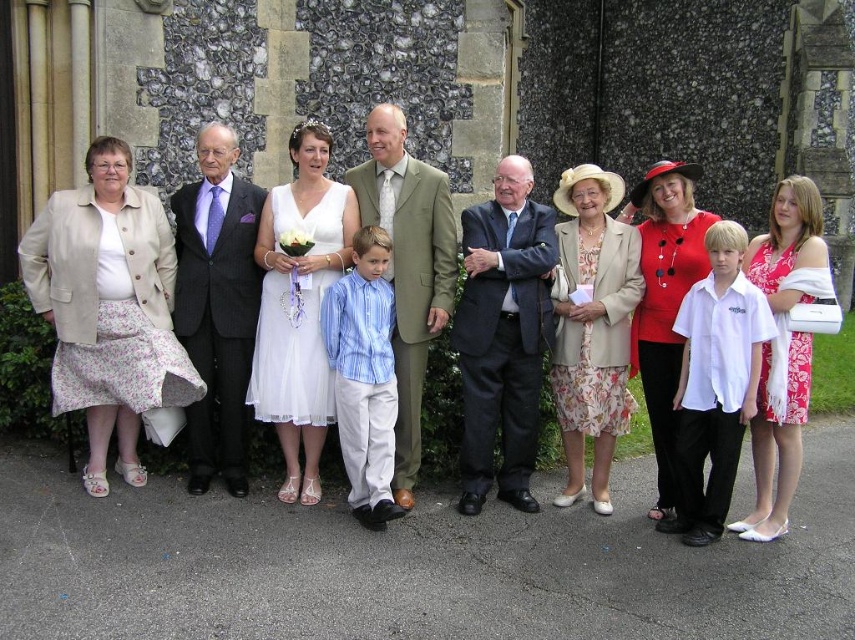
You are a photographer adjusting your camera settings to focus on the floral cotton skirt at left and the white floral dress at center. Which one should you focus on first if you want to capture both in sharp focus?

You should focus on the floral cotton skirt at left first because it is closer to you than the white floral dress at center, ensuring both will be in focus when using depth of field properly.

You are a photographer standing at the edge of a garden, 20 meters away from the stone building where the group is posing. You notice the white floral dress at center in the scene. Can you clearly see the details of the dress from your current position?

The white floral dress at center is 19.87 meters away from the viewer. Since you are standing 20 meters away, you are just slightly farther than the distance to the dress, so you might be able to see the general shape but may not clearly see the intricate details of the dress from that distance.